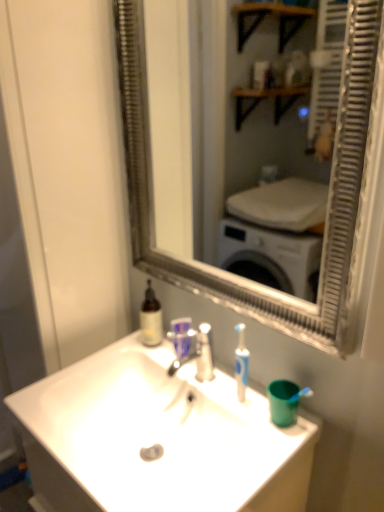
Where is `vacant area situated to the left side of translucent glass bottle at upper left`? vacant area situated to the left side of translucent glass bottle at upper left is located at coordinates (118, 348).